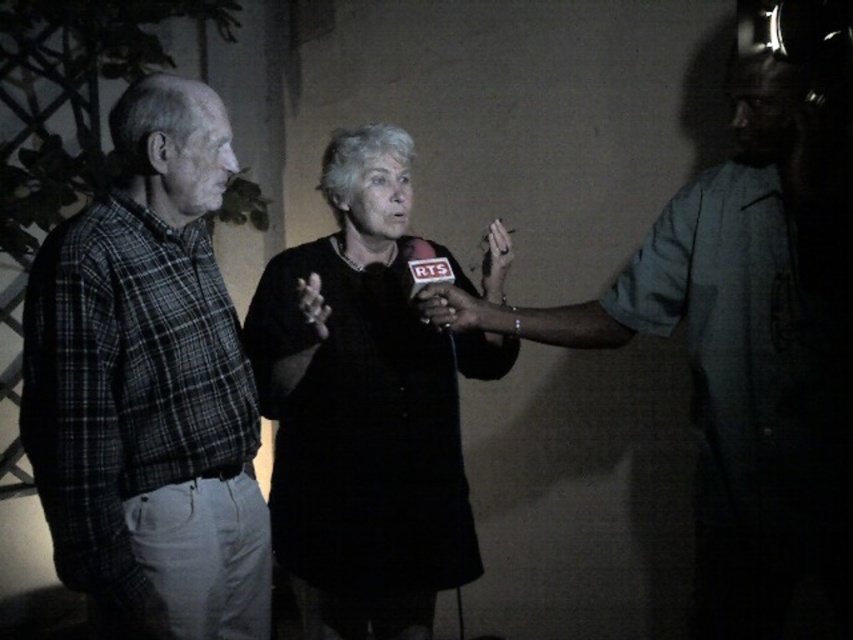
You are standing in the scene and want to move from the point at coordinate (x=398, y=433) to the point at coordinate (x=456, y=296). Which direction should you move to get closer to the older man in the plaid shirt?

You should move forward because the point at coordinate (x=398, y=433) is further to the viewer than the point at coordinate (x=456, y=296), so moving forward would bring you closer to the older man in the plaid shirt.

You are a photographer at this event and want to frame a shot that includes both the matte gray shirt at right and the black matte dress at center. Which object should you focus on first to ensure both are in the frame?

The matte gray shirt at right is taller than the black matte dress at center, so you should focus on the matte gray shirt at right first to ensure both are in the frame.

You are a photographer trying to capture a candid shot of the interview. You need to ensure that both the matte gray shirt at right and the black matte dress at center are visible in the frame. Based on their positions, which one is closer to the right edge of the photo?

The matte gray shirt at right is positioned on the right side of the black matte dress at center, so it is closer to the right edge of the photo.